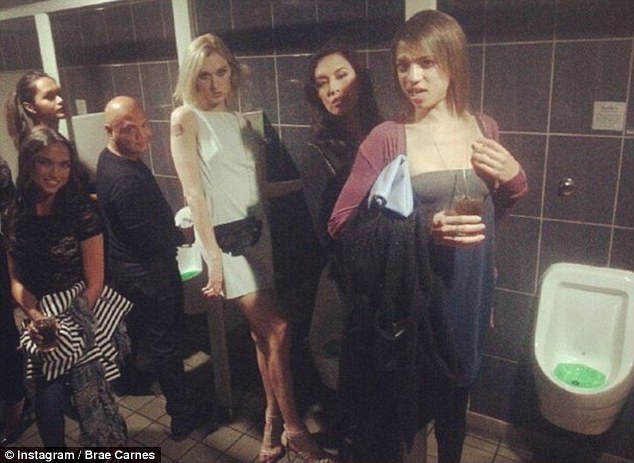
At what (x,y) coordinates should I click in order to perform the action: click on cup. Please return your answer as a coordinate pair (x, y). Looking at the image, I should click on (474, 208).